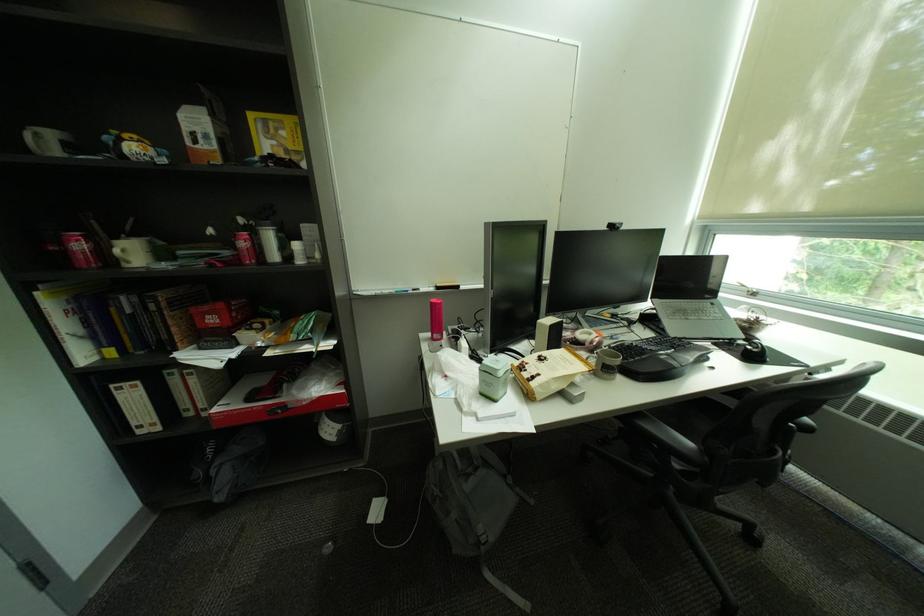
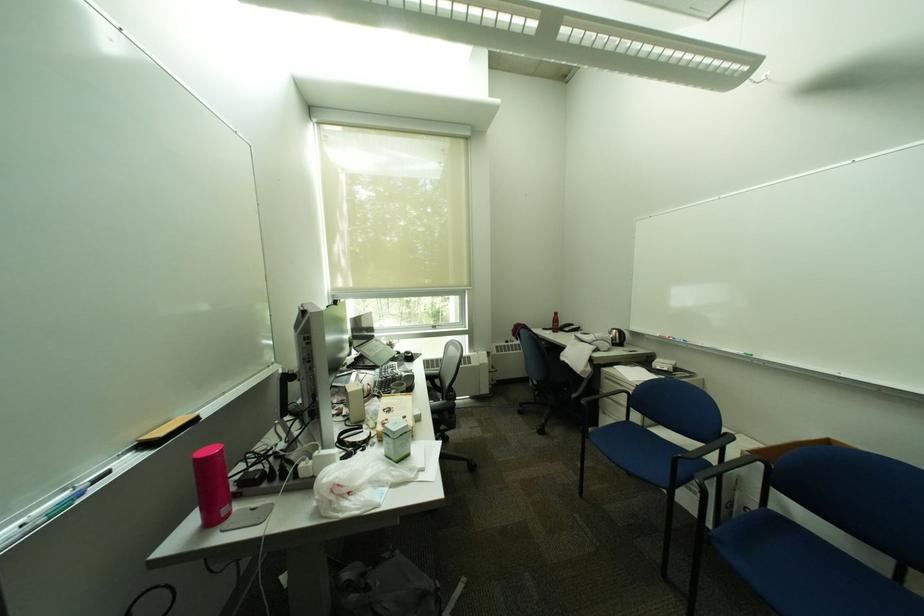
Question: The camera is either moving clockwise (left) or counter-clockwise (right) around the object. The first image is from the beginning of the video and the second image is from the end. Is the camera moving left or right when shooting the video?

Choices:
 (A) Left
 (B) Right

Answer: (A)